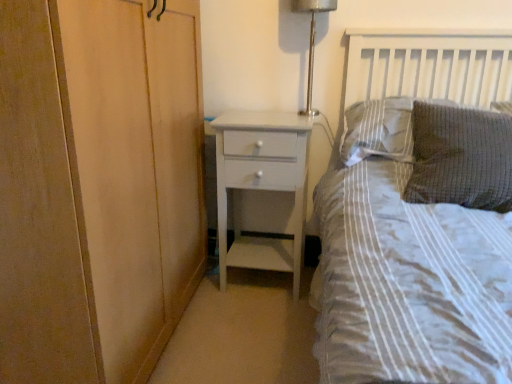
Image resolution: width=512 pixels, height=384 pixels. What are the coordinates of `free space in front of white painted wood chest of drawers at center` in the screenshot? It's located at (240, 327).